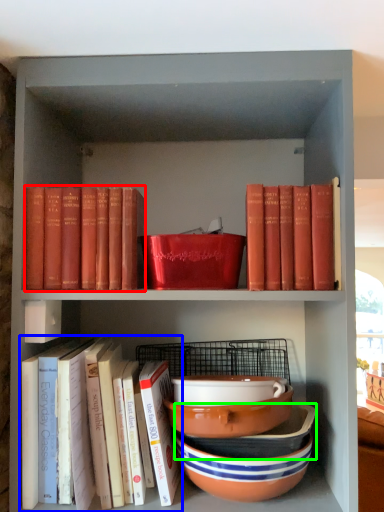
Question: Based on their relative distances, which object is nearer to book (highlighted by a red box)? Choose from book (highlighted by a blue box) and bowl (highlighted by a green box).

Choices:
 (A) book
 (B) bowl

Answer: (A)